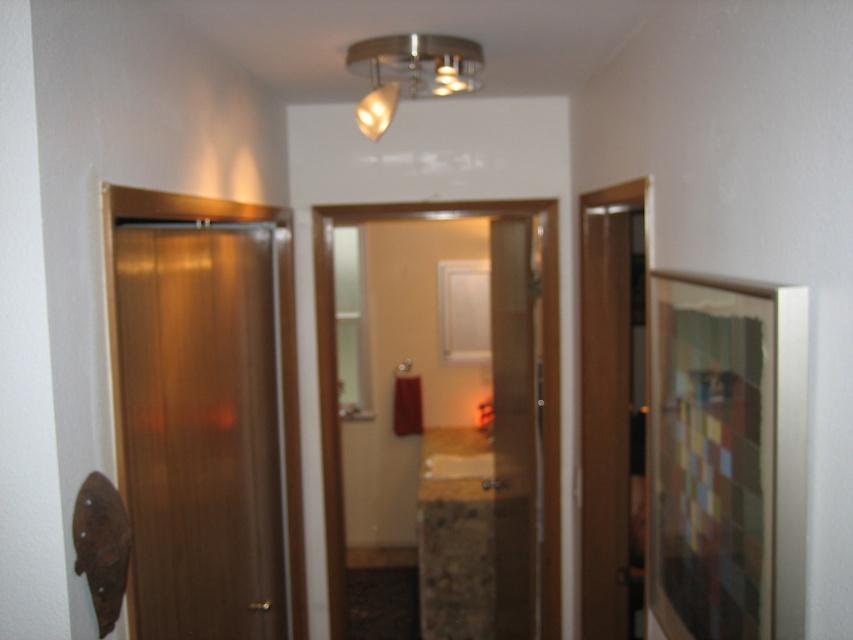
Question: Estimate the real-world distances between objects in this image. Which object is farther from the matte brown door at left?

Choices:
 (A) satin nickel light fixture at upper center
 (B) translucent glass elevator at center
 (C) translucent glass door at center

Answer: (C)

Question: Can you confirm if matte brown door at left is smaller than satin nickel light fixture at upper center?

Choices:
 (A) no
 (B) yes

Answer: (A)

Question: Considering the real-world distances, which object is closest to the translucent glass door at center?

Choices:
 (A) translucent glass elevator at center
 (B) matte brown door at left

Answer: (A)

Question: Is translucent glass elevator at center closer to camera compared to translucent glass door at center?

Choices:
 (A) no
 (B) yes

Answer: (B)

Question: Is matte brown door at left smaller than translucent glass door at center?

Choices:
 (A) no
 (B) yes

Answer: (B)

Question: Which point appears closest to the camera in this image?

Choices:
 (A) (495, 545)
 (B) (221, 596)

Answer: (B)